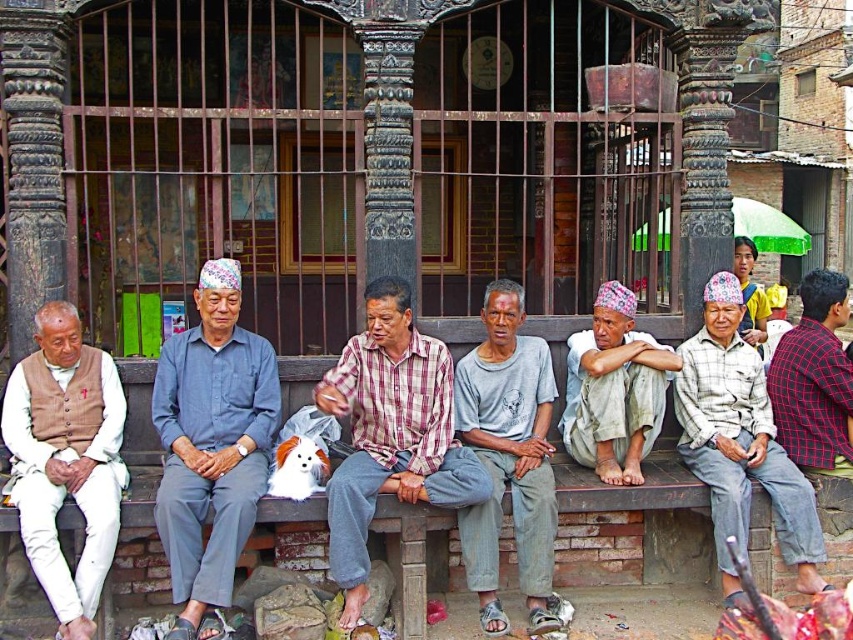
You are standing in front of the traditional building and see the blue cotton shirt at left and the plaid cotton shirt at center. Which one is positioned more to the left?

The blue cotton shirt at left is positioned more to the left than the plaid cotton shirt at center.

You are a tailor observing the blue cotton shirt at left and the plaid cotton shirt at center. Which shirt has a greater width?

The blue cotton shirt at left has a greater width than the plaid cotton shirt at center according to the description.